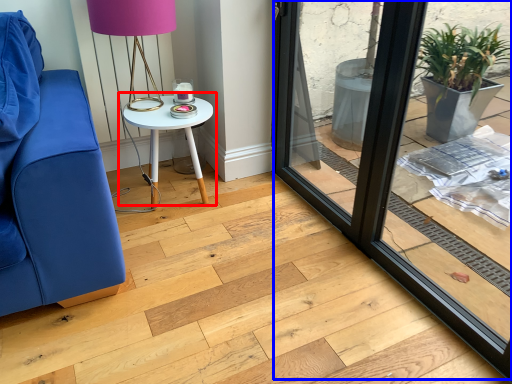
Question: Which object is further to the camera taking this photo, table (highlighted by a red box) or window frame (highlighted by a blue box)?

Choices:
 (A) table
 (B) window frame

Answer: (A)